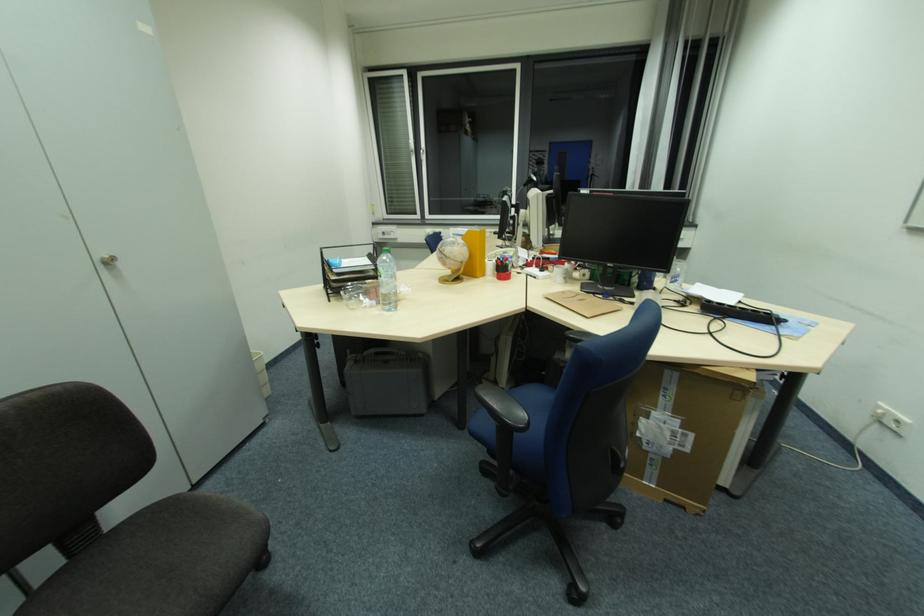
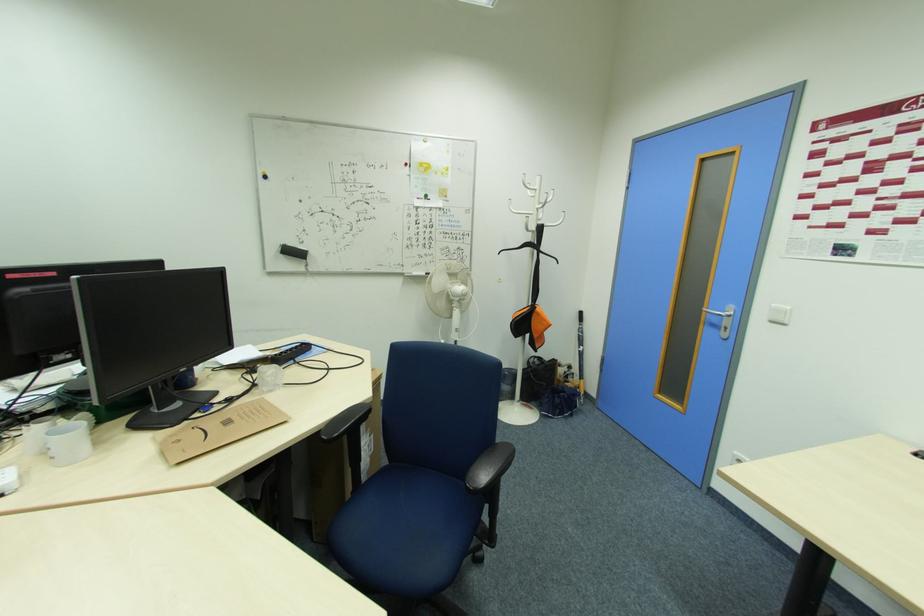
In the second image, find the point that corresponds to pixel 584 301 in the first image.

(232, 424)